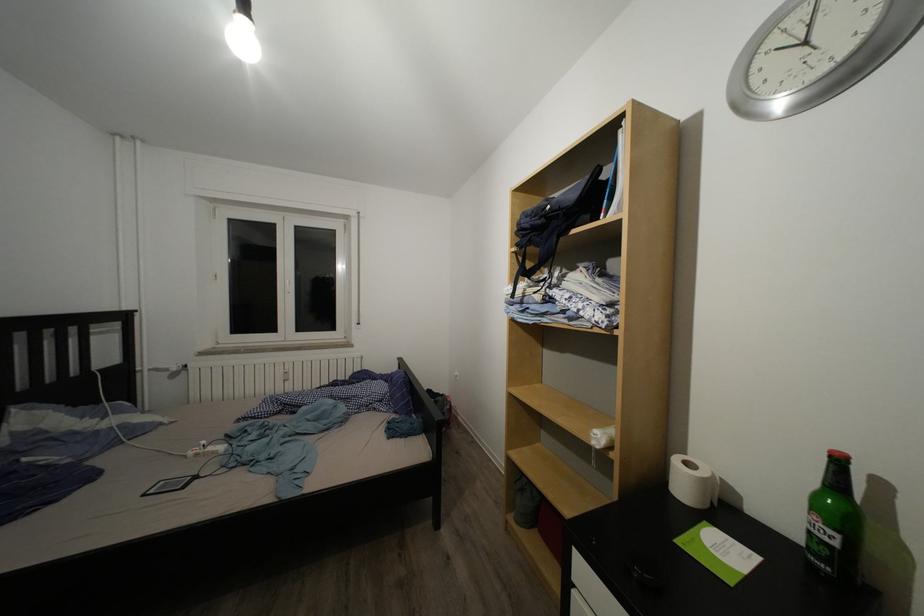
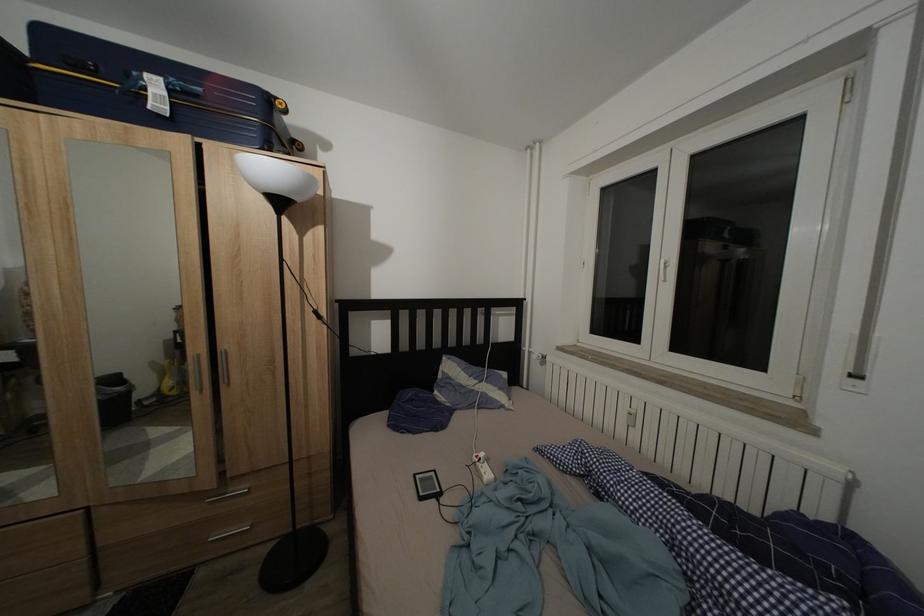
Locate, in the second image, the point that corresponds to the point at 151,501 in the first image.

(422, 482)